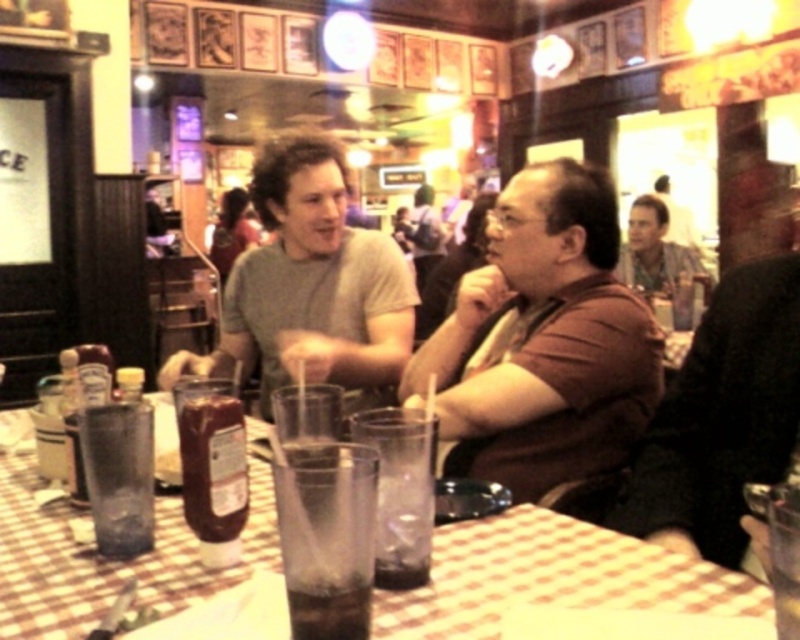
Question: Which of the following is the farthest from the observer?

Choices:
 (A) (272, 497)
 (B) (458, 355)

Answer: (B)

Question: Based on their relative distances, which object is nearer to the checkered fabric table at center?

Choices:
 (A) brown matte shirt at center
 (B) gray matte t-shirt at center
 (C) clear plastic cup at center
 (D) dark brown liquid at table center

Answer: (C)

Question: Is brown leather jacket at right positioned at the back of dark brown liquid at table center?

Choices:
 (A) yes
 (B) no

Answer: (A)

Question: Is the position of brown leather jacket at right more distant than that of dark brown liquid at table center?

Choices:
 (A) yes
 (B) no

Answer: (A)

Question: Among these points, which one is farthest from the camera?

Choices:
 (A) click(x=637, y=502)
 (B) click(x=336, y=317)

Answer: (B)

Question: Can you confirm if gray matte t-shirt at center is thinner than clear plastic cup at center?

Choices:
 (A) no
 (B) yes

Answer: (A)